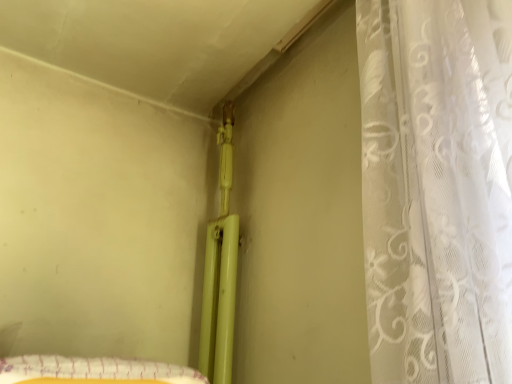
Describe the element at coordinates (437, 188) in the screenshot. I see `white sheer curtain at right` at that location.

This screenshot has height=384, width=512. Find the location of `white sheer curtain at right`. white sheer curtain at right is located at coordinates (437, 188).

Image resolution: width=512 pixels, height=384 pixels. I want to click on yellow fabric at lower left, so click(x=92, y=371).

What do you see at coordinates (92, 371) in the screenshot?
I see `yellow fabric at lower left` at bounding box center [92, 371].

Identify the location of white sheer curtain at right. The height and width of the screenshot is (384, 512). (437, 188).

Considering the relative positions of yellow fabric at lower left and white sheer curtain at right in the image provided, is yellow fabric at lower left to the right of white sheer curtain at right from the viewer's perspective?

In fact, yellow fabric at lower left is to the left of white sheer curtain at right.

Which object is further away from the camera, yellow fabric at lower left or white sheer curtain at right?

Positioned behind is yellow fabric at lower left.

Which point is more forward, (170,370) or (481,43)?

The point (481,43) is closer to the camera.

From the image's perspective, which is below, yellow fabric at lower left or white sheer curtain at right?

yellow fabric at lower left.

From a real-world perspective, is yellow fabric at lower left physically located above or below white sheer curtain at right?

In terms of real-world spatial position, yellow fabric at lower left is below white sheer curtain at right.

Consider the image. Is yellow fabric at lower left wider or thinner than white sheer curtain at right?

yellow fabric at lower left is thinner than white sheer curtain at right.

Can you confirm if yellow fabric at lower left is taller than white sheer curtain at right?

Incorrect, the height of yellow fabric at lower left is not larger of that of white sheer curtain at right.

Looking at the image, does yellow fabric at lower left seem bigger or smaller compared to white sheer curtain at right?

In the image, yellow fabric at lower left appears to be smaller than white sheer curtain at right.

Is white sheer curtain at right a part of yellow fabric at lower left?

No, white sheer curtain at right is not a part of yellow fabric at lower left.

Can you see yellow fabric at lower left touching white sheer curtain at right?

No, yellow fabric at lower left is not touching white sheer curtain at right.

Is yellow fabric at lower left facing away from white sheer curtain at right?

No.

Locate an element on the screen. Image resolution: width=512 pixels, height=384 pixels. curtain on the right of yellow fabric at lower left is located at coordinates (437, 188).

Considering the positions of objects white sheer curtain at right and yellow fabric at lower left in the image provided, who is more to the right, white sheer curtain at right or yellow fabric at lower left?

Positioned to the right is white sheer curtain at right.

Is white sheer curtain at right in front of or behind yellow fabric at lower left in the image?

white sheer curtain at right is in front of yellow fabric at lower left.

Which point is more forward, (x=364, y=25) or (x=84, y=366)?

The point (x=84, y=366) is in front.

From the image's perspective, which is above, white sheer curtain at right or yellow fabric at lower left?

From the image's view, white sheer curtain at right is above.

From a real-world perspective, who is located higher, white sheer curtain at right or yellow fabric at lower left?

In real-world perspective, white sheer curtain at right is above.

Consider the image. Which of these two, white sheer curtain at right or yellow fabric at lower left, is wider?

Wider between the two is white sheer curtain at right.

Considering the relative sizes of white sheer curtain at right and yellow fabric at lower left in the image provided, is white sheer curtain at right shorter than yellow fabric at lower left?

Incorrect, the height of white sheer curtain at right does not fall short of that of yellow fabric at lower left.

Is white sheer curtain at right bigger than yellow fabric at lower left?

Correct, white sheer curtain at right is larger in size than yellow fabric at lower left.

Which is correct: white sheer curtain at right is inside yellow fabric at lower left, or outside of it?

white sheer curtain at right is spatially situated outside yellow fabric at lower left.

Would you say white sheer curtain at right is a long distance from yellow fabric at lower left?

white sheer curtain at right is actually quite close to yellow fabric at lower left.

Is white sheer curtain at right turned away from yellow fabric at lower left?

No.

How many degrees apart are the facing directions of white sheer curtain at right and yellow fabric at lower left?

white sheer curtain at right and yellow fabric at lower left are facing 92 degrees away from each other.

This screenshot has height=384, width=512. I want to click on sheet below the white sheer curtain at right (from the image's perspective), so click(92, 371).

You are a GUI agent. You are given a task and a screenshot of the screen. Output one action in this format:
    pyautogui.click(x=<x>, y=<y>)
    Task: Click on the sheet that is under the white sheer curtain at right (from a real-world perspective)
    
    Given the screenshot: What is the action you would take?
    pyautogui.click(x=92, y=371)

I want to click on curtain on the right of yellow fabric at lower left, so click(437, 188).